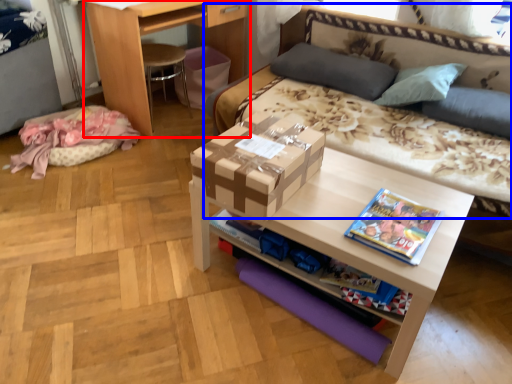
Question: Which object appears farthest to the camera in this image, desk (highlighted by a red box) or studio couch (highlighted by a blue box)?

Choices:
 (A) desk
 (B) studio couch

Answer: (A)